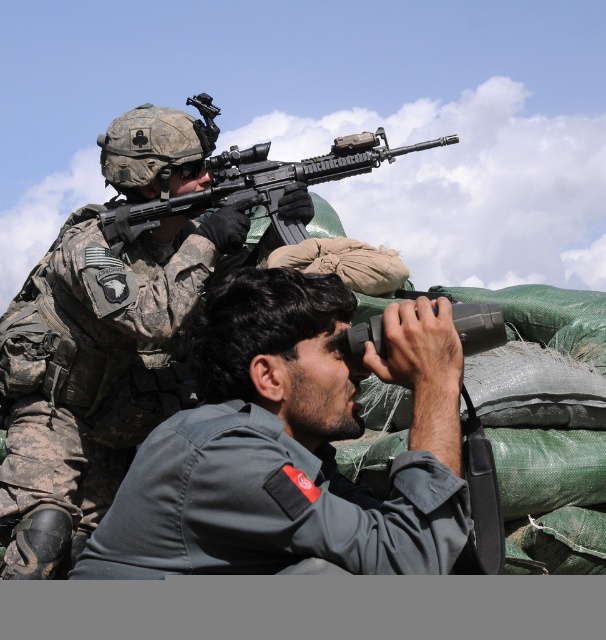
You are a new recruit in the military unit and need to determine which equipment is larger between the matte black rifle at upper center and the black rubber binoculars at center. Which one is bigger?

The matte black rifle at upper center is bigger than the black rubber binoculars at center.

You are a soldier in the field and need to retrieve the gray fabric binoculars at center for immediate use. Considering your current position, can you reach them without moving more than 45 meters?

The gray fabric binoculars at center are 46.29 meters away from you, so you cannot reach them within 45 meters without moving further than allowed.

You are a drone operator trying to determine which of the two points, point (316, 433) or point (116, 220), is closer to you. Based on the scene provided, which point is nearer?

Point (316, 433) is closer to the viewer than point (116, 220).